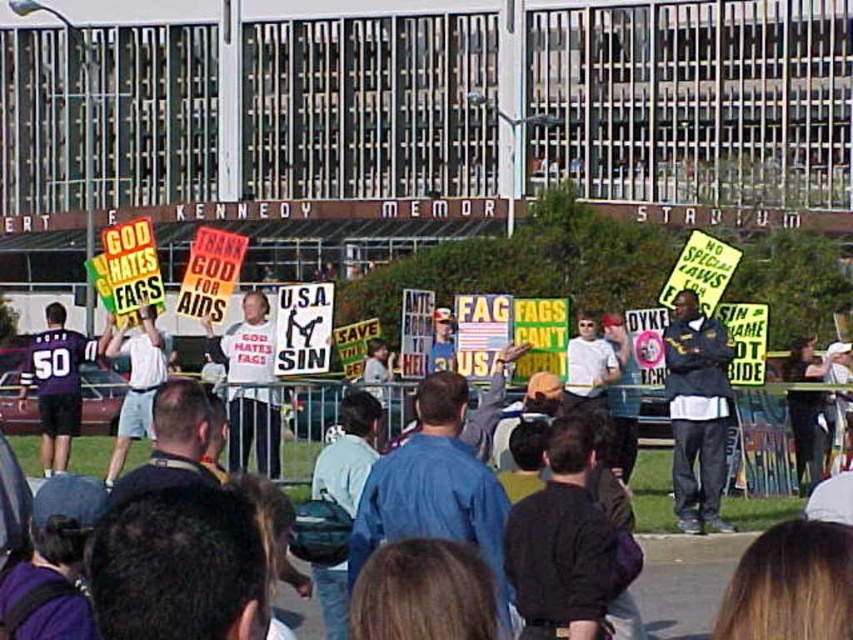
You are a protestor standing at the point marked by the coordinate point at point (103,340). You want to move to the other side of the JFK KENNEDY MEMORIAL STADIUM to join your friends. The stadium is 100 meters wide. Can you walk around the stadium without crossing through the protest area?

The distance between the point marked by the coordinate point at point (103,340) and the other side of the JFK KENNEDY MEMORIAL STADIUM is 18.95 meters. Since the stadium is 100 meters wide, you would need to walk around the perimeter, which is much longer than 18.95 meters. Therefore, you can go around the stadium without crossing through the protest area.

You are a photographer at the protest scene. You need to capture a photo where both the dark blue jacket at center and the matte purple jersey at left are clearly visible. Considering their heights, which object should be placed closer to the front to ensure both are visible in the frame?

The dark blue jacket at center, which is shorter, should be placed closer to the front to ensure it doesn not get obscured by the taller matte purple jersey at left.